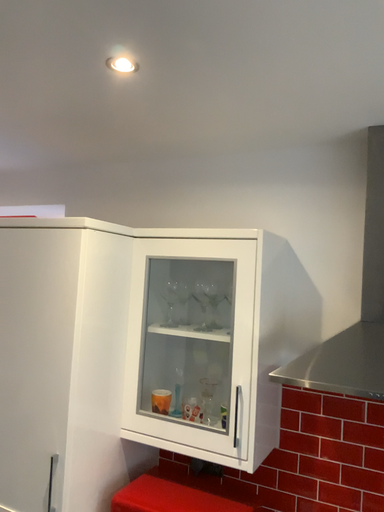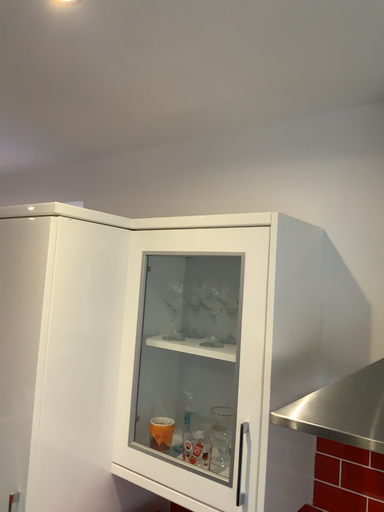
Question: Which way did the camera rotate in the video?

Choices:
 (A) rotated right
 (B) rotated left

Answer: (B)